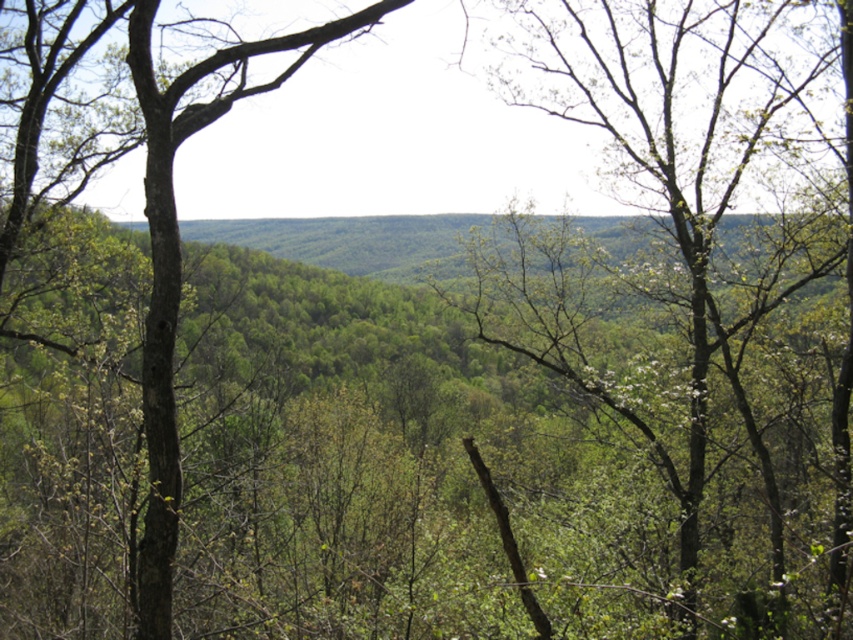
Which is below, green leafy tree at center or green rough bark tree at left?

green leafy tree at center is below.

Identify the location of green leafy tree at center. This screenshot has width=853, height=640. (691, 301).